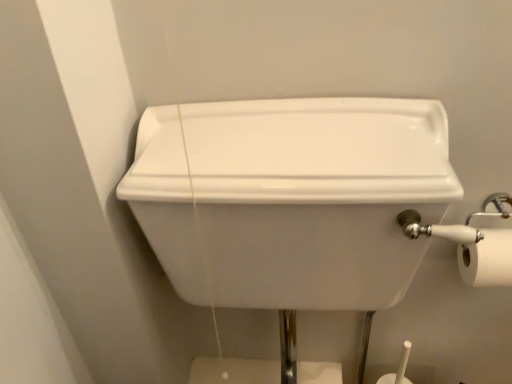
What do you see at coordinates (290, 198) in the screenshot? This screenshot has height=384, width=512. I see `white glossy sink at center` at bounding box center [290, 198].

Where is `white glossy sink at center`? This screenshot has height=384, width=512. white glossy sink at center is located at coordinates (290, 198).

Measure the distance between white matte toilet paper at right and camera.

They are 78.58 centimeters apart.

Describe the element at coordinates (487, 259) in the screenshot. I see `white matte toilet paper at right` at that location.

Locate an element on the screen. This screenshot has width=512, height=384. white matte toilet paper at right is located at coordinates (487, 259).

What are the coordinates of `white glossy sink at center` in the screenshot? It's located at (290, 198).

Looking at this image, is white matte toilet paper at right to the left or to the right of white glossy sink at center in the image?

Clearly, white matte toilet paper at right is on the right of white glossy sink at center in the image.

Is white matte toilet paper at right further to camera compared to white glossy sink at center?

Yes, it is behind white glossy sink at center.

Between point (500, 241) and point (241, 133), which one is positioned behind?

The point (500, 241) is farther from the camera.

From the image's perspective, which object appears higher, white matte toilet paper at right or white glossy sink at center?

From the image's view, white matte toilet paper at right is above.

From a real-world perspective, who is located higher, white matte toilet paper at right or white glossy sink at center?

white matte toilet paper at right, from a real-world perspective.

Is white matte toilet paper at right wider than white glossy sink at center?

No.

Who is taller, white matte toilet paper at right or white glossy sink at center?

With more height is white glossy sink at center.

Considering the sizes of objects white matte toilet paper at right and white glossy sink at center in the image provided, who is bigger, white matte toilet paper at right or white glossy sink at center?

white glossy sink at center.

Is white glossy sink at center a part of white matte toilet paper at right?

Actually, white glossy sink at center is outside white matte toilet paper at right.

Is white matte toilet paper at right beside white glossy sink at center?

No, white matte toilet paper at right is not with white glossy sink at center.

Could you tell me if white matte toilet paper at right is facing white glossy sink at center?

No.

What's the angular difference between white matte toilet paper at right and white glossy sink at center's facing directions?

The angular difference between white matte toilet paper at right and white glossy sink at center is 0.694 degrees.

This screenshot has width=512, height=384. In order to click on sink on the left of white matte toilet paper at right in this screenshot , I will do `click(290, 198)`.

Is white glossy sink at center to the left or to the right of white matte toilet paper at right in the image?

white glossy sink at center is positioned on white matte toilet paper at right's left side.

Considering the positions of objects white glossy sink at center and white matte toilet paper at right in the image provided, who is in front, white glossy sink at center or white matte toilet paper at right?

white glossy sink at center.

Is point (193, 258) behind point (504, 229)?

No, (193, 258) is closer to viewer.

From the image's perspective, is white glossy sink at center positioned above or below white matte toilet paper at right?

Based on their image positions, white glossy sink at center is located beneath white matte toilet paper at right.

From a real-world perspective, is white glossy sink at center physically below white matte toilet paper at right?

Correct, in the physical world, white glossy sink at center is lower than white matte toilet paper at right.

Which object is wider, white glossy sink at center or white matte toilet paper at right?

white glossy sink at center is wider.

Considering the sizes of objects white glossy sink at center and white matte toilet paper at right in the image provided, who is taller, white glossy sink at center or white matte toilet paper at right?

white glossy sink at center is taller.

Does white glossy sink at center have a larger size compared to white matte toilet paper at right?

Yes, white glossy sink at center is bigger than white matte toilet paper at right.

Is white matte toilet paper at right located within white glossy sink at center?

No, white matte toilet paper at right is not surrounded by white glossy sink at center.

Is the surface of white glossy sink at center in direct contact with white matte toilet paper at right?

They are not placed beside each other.

Is white matte toilet paper at right at the back of white glossy sink at center?

No, white glossy sink at center's orientation is not away from white matte toilet paper at right.

At what (x,y) coordinates should I click in order to perform the action: click on sink below the white matte toilet paper at right (from the image's perspective). Please return your answer as a coordinate pair (x, y). The image size is (512, 384). Looking at the image, I should click on (290, 198).

You are a GUI agent. You are given a task and a screenshot of the screen. Output one action in this format:
    pyautogui.click(x=<x>, y=<y>)
    Task: Click on the toilet paper that is behind the white glossy sink at center
    
    Given the screenshot: What is the action you would take?
    pyautogui.click(x=487, y=259)

What are the coordinates of `sink directly beneath the white matte toilet paper at right (from a real-world perspective)` in the screenshot? It's located at (290, 198).